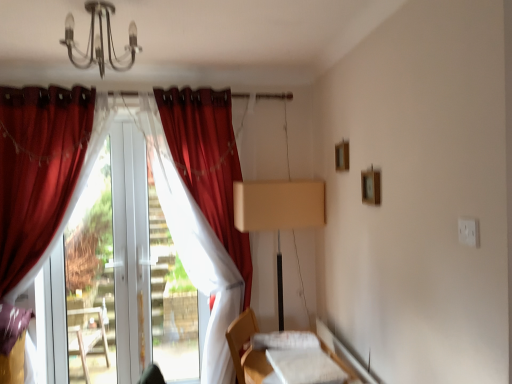
Question: Does transparent plastic window screen at center have a greater height compared to white fabric at lower right?

Choices:
 (A) yes
 (B) no

Answer: (A)

Question: Is transparent plastic window screen at center wider than white fabric at lower right?

Choices:
 (A) no
 (B) yes

Answer: (A)

Question: Can you confirm if transparent plastic window screen at center is smaller than white fabric at lower right?

Choices:
 (A) no
 (B) yes

Answer: (A)

Question: Does transparent plastic window screen at center have a lesser width compared to white fabric at lower right?

Choices:
 (A) yes
 (B) no

Answer: (A)

Question: Is transparent plastic window screen at center not near white fabric at lower right?

Choices:
 (A) no
 (B) yes

Answer: (B)

Question: Is the depth of transparent plastic window screen at center greater than that of white fabric at lower right?

Choices:
 (A) yes
 (B) no

Answer: (A)

Question: From the image's perspective, is metallic chandelier at upper center above white fabric bed at lower center?

Choices:
 (A) no
 (B) yes

Answer: (B)

Question: Is metallic chandelier at upper center bigger than white fabric bed at lower center?

Choices:
 (A) yes
 (B) no

Answer: (B)

Question: Can you confirm if metallic chandelier at upper center is smaller than white fabric bed at lower center?

Choices:
 (A) no
 (B) yes

Answer: (B)

Question: Is there a large distance between metallic chandelier at upper center and white fabric bed at lower center?

Choices:
 (A) no
 (B) yes

Answer: (B)

Question: Is metallic chandelier at upper center aimed at white fabric bed at lower center?

Choices:
 (A) no
 (B) yes

Answer: (A)

Question: Is metallic chandelier at upper center thinner than white fabric bed at lower center?

Choices:
 (A) yes
 (B) no

Answer: (A)

Question: Is velvet red curtain at left, the third curtain from the left, positioned with its back to white fabric bed at lower center?

Choices:
 (A) yes
 (B) no

Answer: (B)